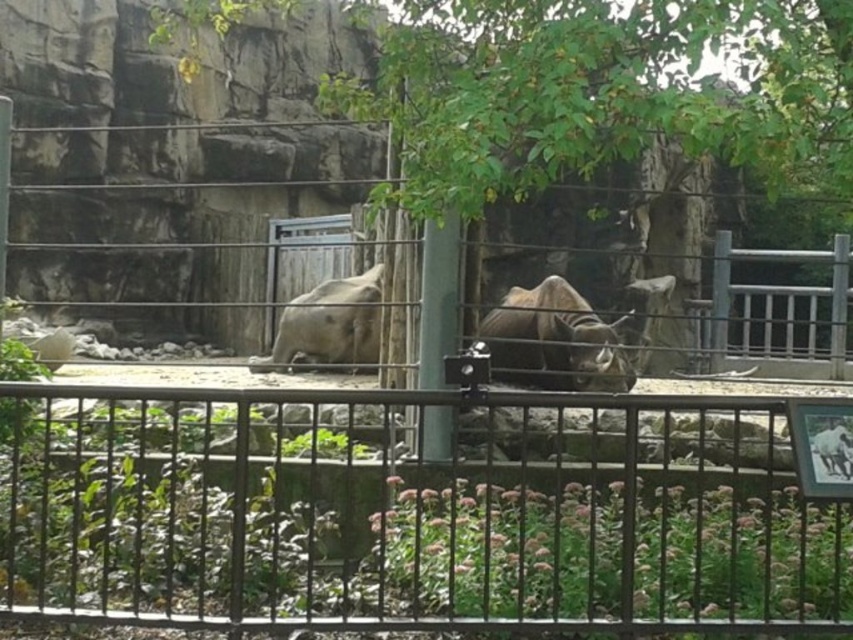
Can you confirm if green leafy tree at upper center is shorter than brown textured rhino at center?

Yes, green leafy tree at upper center is shorter than brown textured rhino at center.

Is point (827, 16) closer to viewer compared to point (517, 353)?

Yes, point (827, 16) is closer to viewer.

Is point (538, 86) positioned in front of point (531, 364)?

Yes, point (538, 86) is closer to viewer.

Where is `green leafy tree at upper center`? This screenshot has width=853, height=640. green leafy tree at upper center is located at coordinates (602, 92).

What do you see at coordinates (602, 92) in the screenshot? I see `green leafy tree at upper center` at bounding box center [602, 92].

Where is `green leafy tree at upper center`? This screenshot has width=853, height=640. green leafy tree at upper center is located at coordinates (602, 92).

Can you confirm if metallic black fence at center is smaller than gray matte rhino at center?

Incorrect, metallic black fence at center is not smaller in size than gray matte rhino at center.

Consider the image. Does metallic black fence at center appear on the right side of gray matte rhino at center?

Indeed, metallic black fence at center is positioned on the right side of gray matte rhino at center.

What do you see at coordinates (410, 515) in the screenshot?
I see `metallic black fence at center` at bounding box center [410, 515].

At what (x,y) coordinates should I click in order to perform the action: click on metallic black fence at center. Please return your answer as a coordinate pair (x, y). Image resolution: width=853 pixels, height=640 pixels. Looking at the image, I should click on (410, 515).